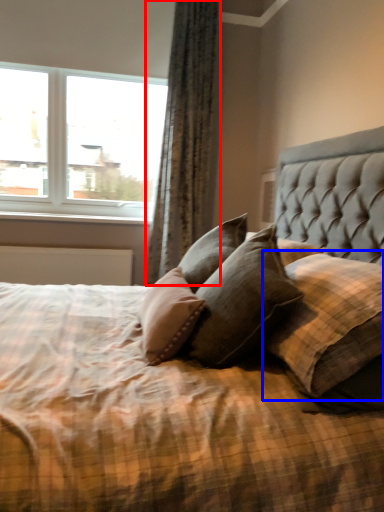
Question: Among these objects, which one is farthest to the camera, curtain (highlighted by a red box) or pillow (highlighted by a blue box)?

Choices:
 (A) curtain
 (B) pillow

Answer: (A)